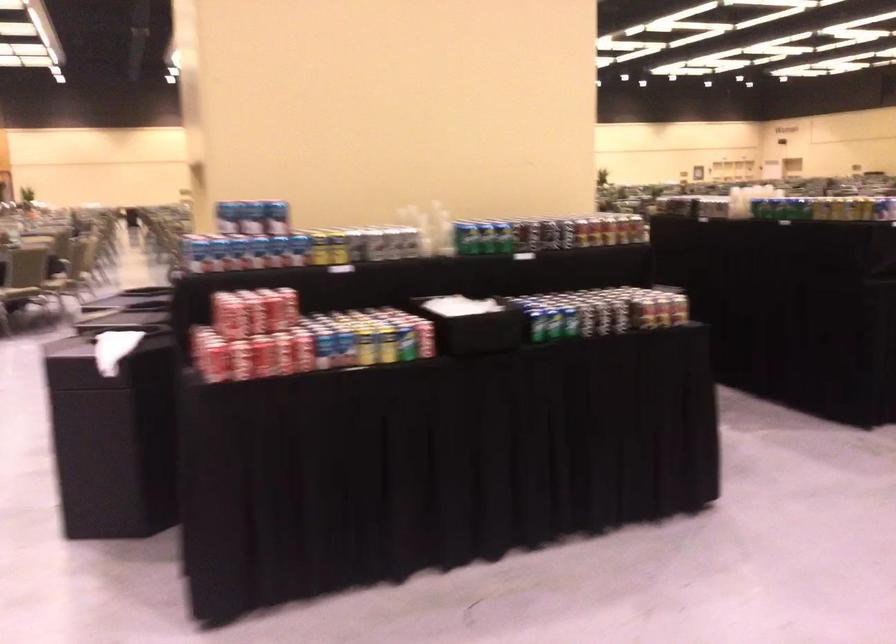
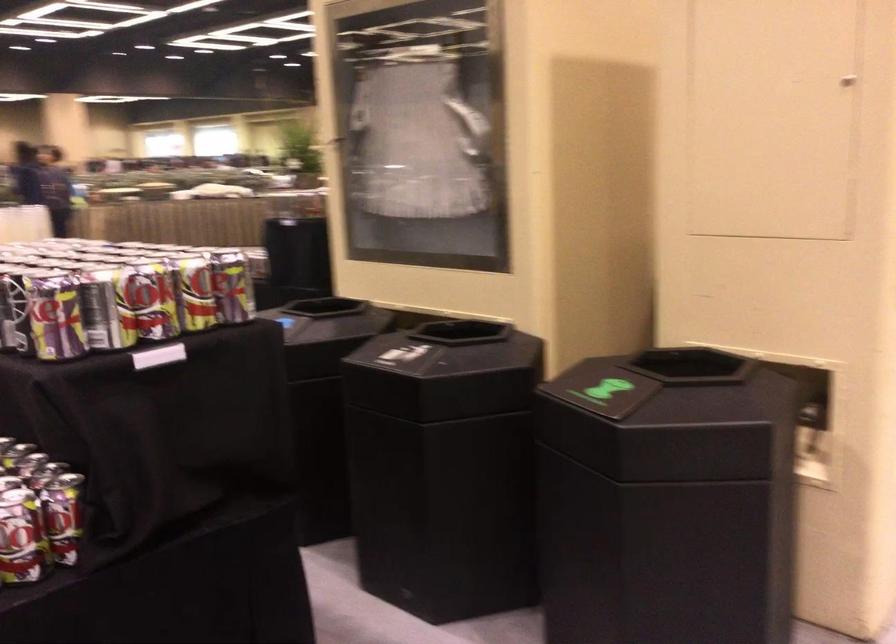
Question: I am providing you with two images of the same scene from different viewpoints. After the viewpoint changes to image2, which objects are now occluded?

Choices:
 (A) orange throw pillow
 (B) blue soda can
 (C) beverage can
 (D) black bin opening

Answer: (B)